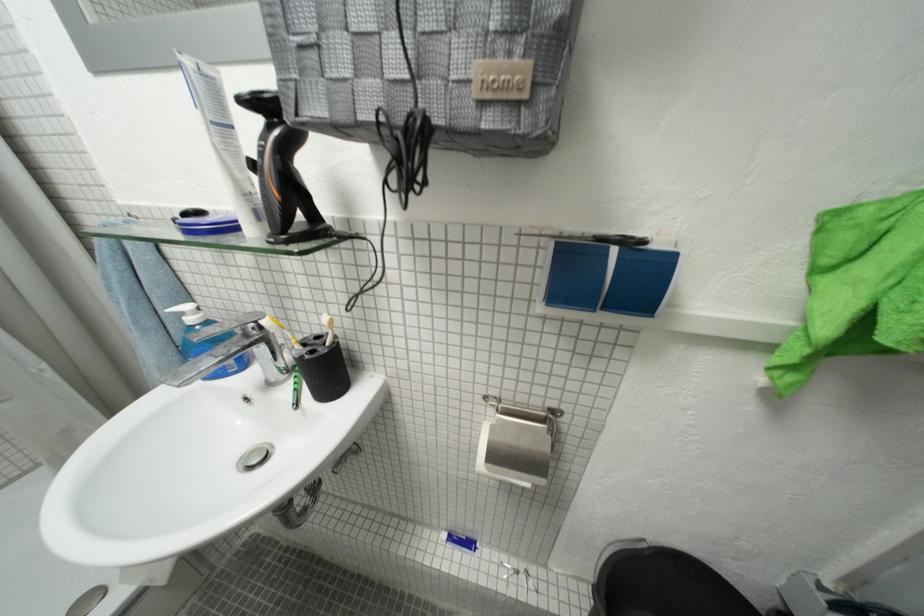
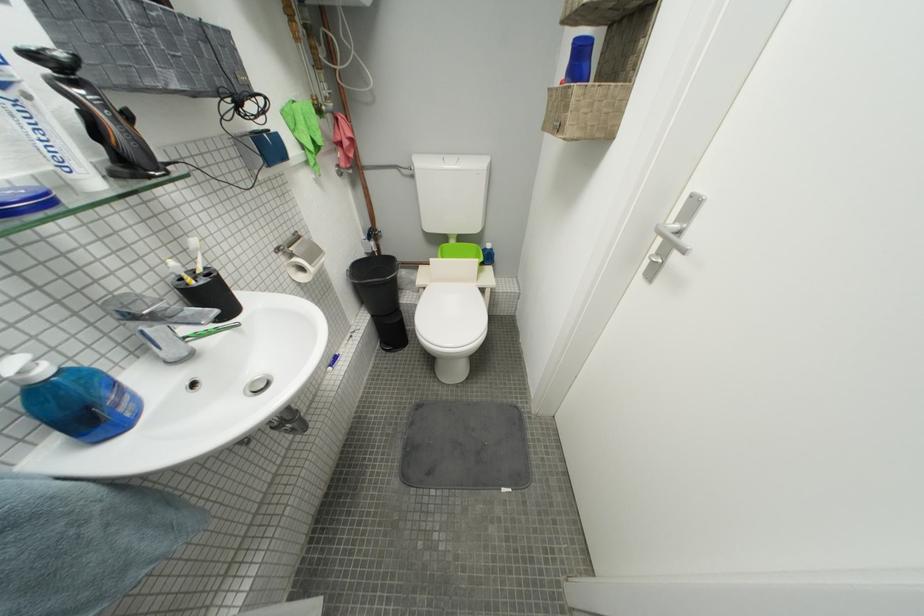
Where in the second image is the point corresponding to [201,322] from the first image?

(53, 374)